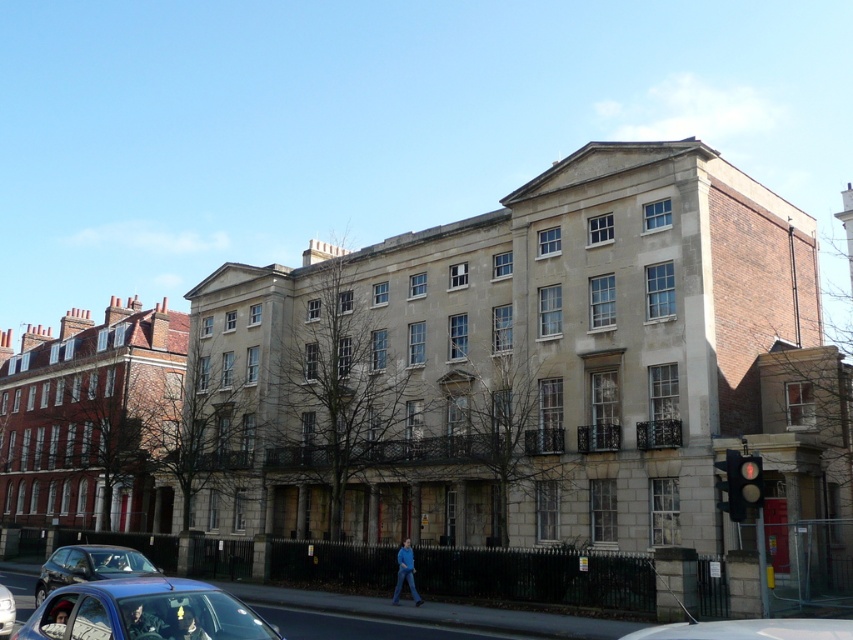
Which is more to the right, metallic silver car at lower left or red glass traffic light at right?

red glass traffic light at right is more to the right.

Which is above, metallic silver car at lower left or red glass traffic light at right?

red glass traffic light at right is above.

Describe the element at coordinates (90, 566) in the screenshot. This screenshot has width=853, height=640. I see `metallic silver car at lower left` at that location.

You are a GUI agent. You are given a task and a screenshot of the screen. Output one action in this format:
    pyautogui.click(x=<x>, y=<y>)
    Task: Click on the metallic silver car at lower left
    This screenshot has width=853, height=640.
    Given the screenshot: What is the action you would take?
    pyautogui.click(x=90, y=566)

Which is more to the right, metallic traffic light at right or silver metallic car at lower left?

metallic traffic light at right is more to the right.

Identify the location of metallic traffic light at right. This screenshot has width=853, height=640. (740, 483).

Does matte blue car at lower left lie in front of metallic traffic light at right?

Yes, it is in front of metallic traffic light at right.

Who is more forward, (276, 636) or (720, 488)?

Point (276, 636) is in front.

What are the coordinates of `matte blue car at lower left` in the screenshot? It's located at (144, 612).